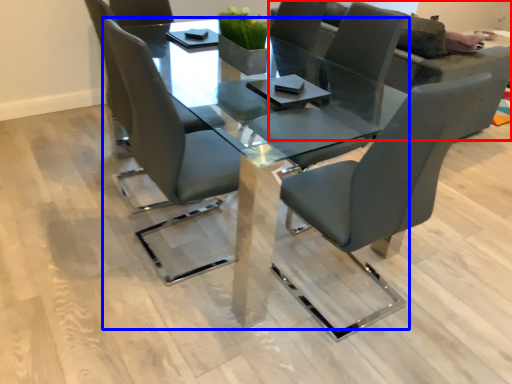
Question: Which point is closer to the camera, couch (highlighted by a red box) or table (highlighted by a blue box)?

Choices:
 (A) couch
 (B) table

Answer: (B)